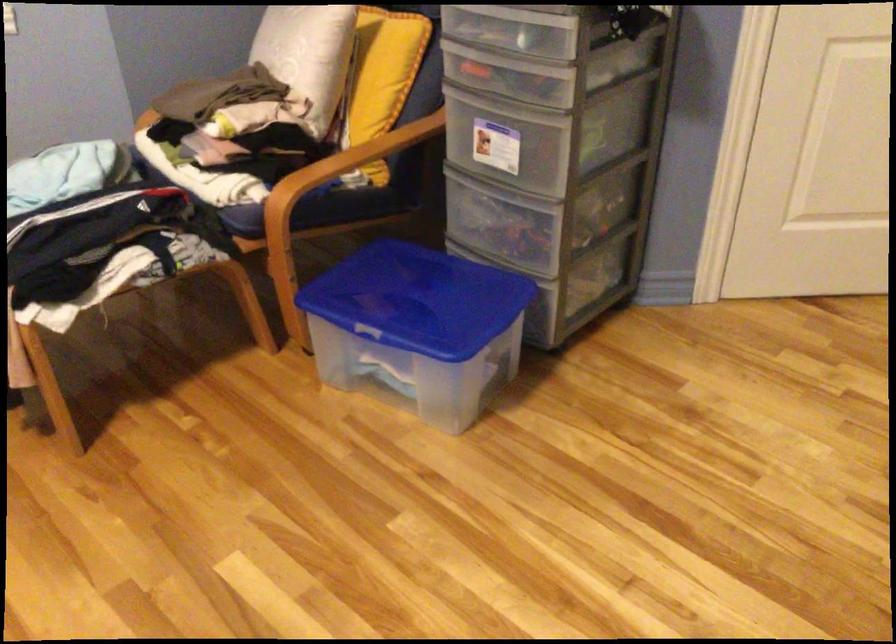
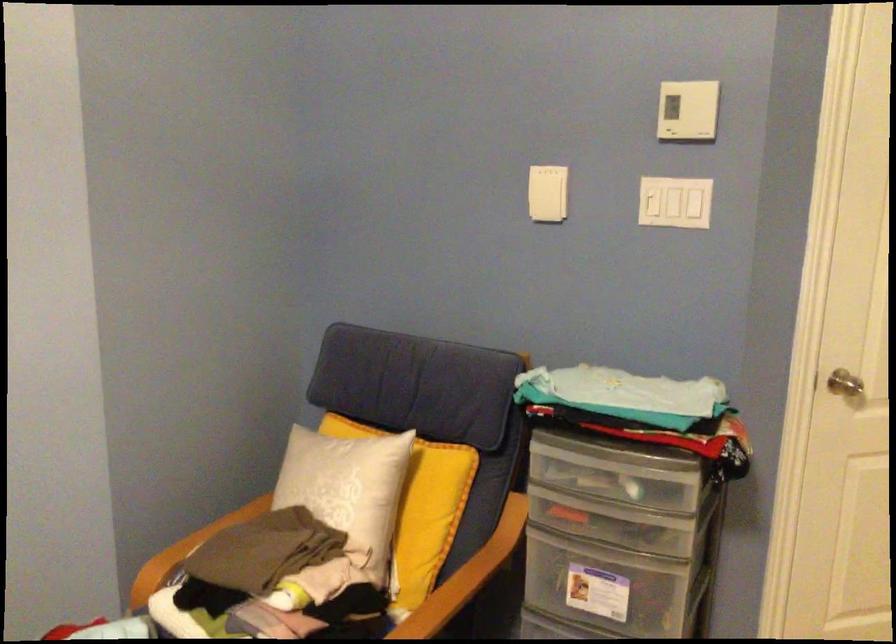
Question: What movement of the cameraman would produce the second image?

Choices:
 (A) Left
 (B) Right
 (C) Forward
 (D) Backward

Answer: (A)